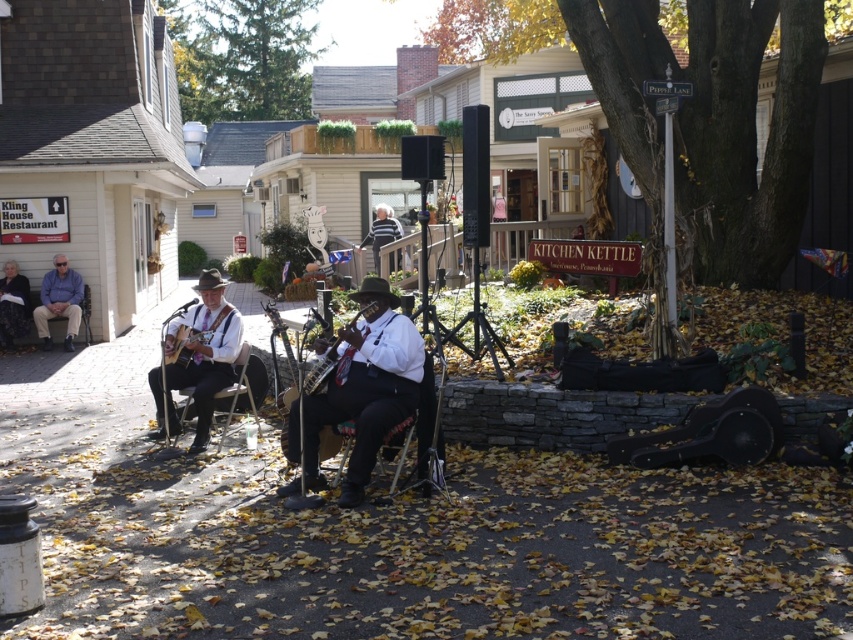
Question: Is matte blue shirt at left wider than wooden acoustic guitar at center?

Choices:
 (A) yes
 (B) no

Answer: (A)

Question: Which point is farther from the camera taking this photo?

Choices:
 (A) (202, 358)
 (B) (416, 394)
 (C) (334, 340)

Answer: (A)

Question: Which point appears farthest from the camera in this image?

Choices:
 (A) (199, 336)
 (B) (61, 268)
 (C) (178, 323)

Answer: (B)

Question: From the image, what is the correct spatial relationship of matte black guitar at left in relation to wooden acoustic guitar at center?

Choices:
 (A) above
 (B) below

Answer: (B)

Question: From the image, what is the correct spatial relationship of matte black guitar at left in relation to wooden acoustic guitar at left?

Choices:
 (A) right
 (B) left

Answer: (B)

Question: Among these objects, which one is nearest to the camera?

Choices:
 (A) wooden acoustic guitar at left
 (B) wooden acoustic guitar at center
 (C) matte blue shirt at left
 (D) matte black guitar at left

Answer: (B)